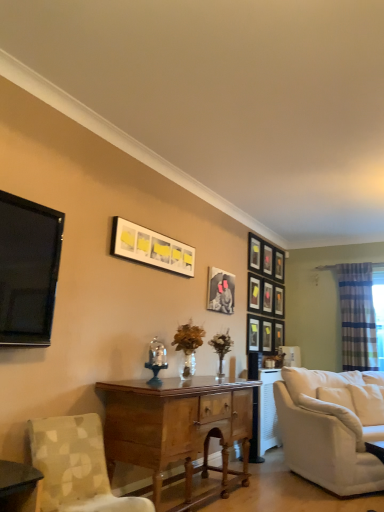
Question: Is black glossy tv at left positioned with its back to matte black picture frame at center-right, arranged as the sixth picture frame when viewed from the right?

Choices:
 (A) no
 (B) yes

Answer: (A)

Question: Does black glossy tv at left appear on the left side of matte black picture frame at center-right, which appears as the 6th picture frame when viewed from the left?

Choices:
 (A) no
 (B) yes

Answer: (B)

Question: Does black glossy tv at left have a lesser width compared to matte black picture frame at center-right, arranged as the sixth picture frame when viewed from the right?

Choices:
 (A) no
 (B) yes

Answer: (A)

Question: Considering the relative sizes of black glossy tv at left and matte black picture frame at center-right, arranged as the sixth picture frame when viewed from the right, in the image provided, is black glossy tv at left shorter than matte black picture frame at center-right, arranged as the sixth picture frame when viewed from the right,?

Choices:
 (A) yes
 (B) no

Answer: (B)

Question: Can you confirm if black glossy tv at left is positioned to the right of matte black picture frame at center-right, which appears as the 6th picture frame when viewed from the left?

Choices:
 (A) no
 (B) yes

Answer: (A)

Question: Is there a large distance between black glossy tv at left and matte black picture frame at center-right, which appears as the 6th picture frame when viewed from the left?

Choices:
 (A) no
 (B) yes

Answer: (B)

Question: Is black glossy tv at left outside patterned fabric chair at lower left?

Choices:
 (A) yes
 (B) no

Answer: (A)

Question: Is black glossy tv at left aimed at patterned fabric chair at lower left?

Choices:
 (A) yes
 (B) no

Answer: (B)

Question: From a real-world perspective, is black glossy tv at left on top of patterned fabric chair at lower left?

Choices:
 (A) yes
 (B) no

Answer: (A)

Question: Does black glossy tv at left appear on the right side of patterned fabric chair at lower left?

Choices:
 (A) yes
 (B) no

Answer: (B)

Question: Is black glossy tv at left turned away from patterned fabric chair at lower left?

Choices:
 (A) yes
 (B) no

Answer: (B)

Question: Considering the relative sizes of black glossy tv at left and patterned fabric chair at lower left in the image provided, is black glossy tv at left taller than patterned fabric chair at lower left?

Choices:
 (A) yes
 (B) no

Answer: (A)

Question: Does matte black picture frame at center, placed as the 10th picture frame when sorted from right to left, have a larger size compared to matte black picture frame at upper right, which appears as the fifth picture frame when viewed from the left?

Choices:
 (A) yes
 (B) no

Answer: (A)